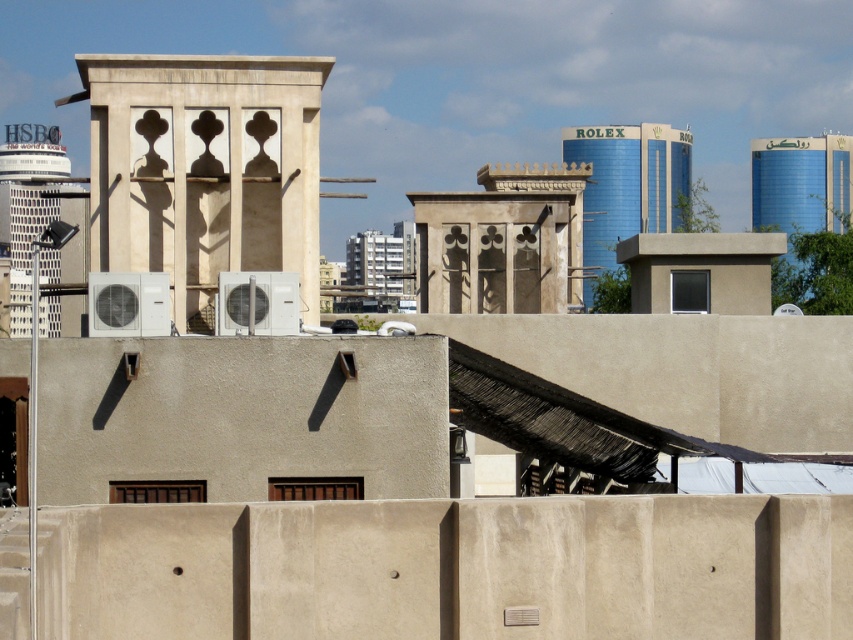
Which is more to the right, blue glass tower at upper right or blue metallic tower at upper right?

Positioned to the right is blue glass tower at upper right.

You are a GUI agent. You are given a task and a screenshot of the screen. Output one action in this format:
    pyautogui.click(x=<x>, y=<y>)
    Task: Click on the blue glass tower at upper right
    Image resolution: width=853 pixels, height=640 pixels.
    Given the screenshot: What is the action you would take?
    pyautogui.click(x=805, y=216)

What do you see at coordinates (805, 216) in the screenshot?
I see `blue glass tower at upper right` at bounding box center [805, 216].

Image resolution: width=853 pixels, height=640 pixels. What are the coordinates of `blue glass tower at upper right` in the screenshot? It's located at (805, 216).

Does beige concrete tower at center appear on the right side of white concrete tower at left?

Indeed, beige concrete tower at center is positioned on the right side of white concrete tower at left.

Can you confirm if beige concrete tower at center is shorter than white concrete tower at left?

Correct, beige concrete tower at center is not as tall as white concrete tower at left.

Find the location of a particular element. This screenshot has height=640, width=853. beige concrete tower at center is located at coordinates (204, 170).

From the picture: Which is above, blue metallic tower at upper right or white concrete tower at left?

Positioned higher is blue metallic tower at upper right.

Can you confirm if blue metallic tower at upper right is positioned below white concrete tower at left?

Actually, blue metallic tower at upper right is above white concrete tower at left.

Locate an element on the screen. The width and height of the screenshot is (853, 640). blue metallic tower at upper right is located at coordinates (628, 182).